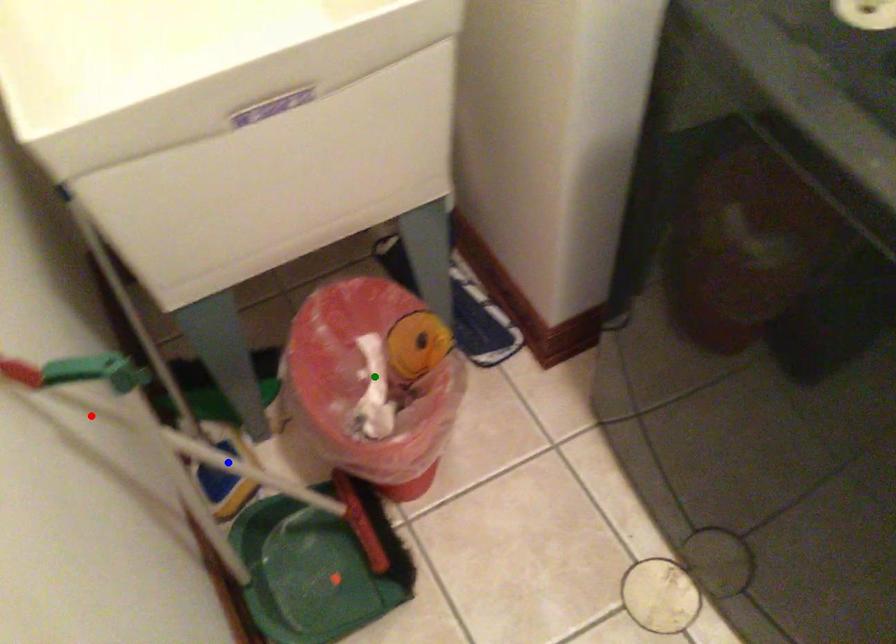
Order these from nearest to farthest:
- green point
- blue point
- red point

red point, blue point, green point